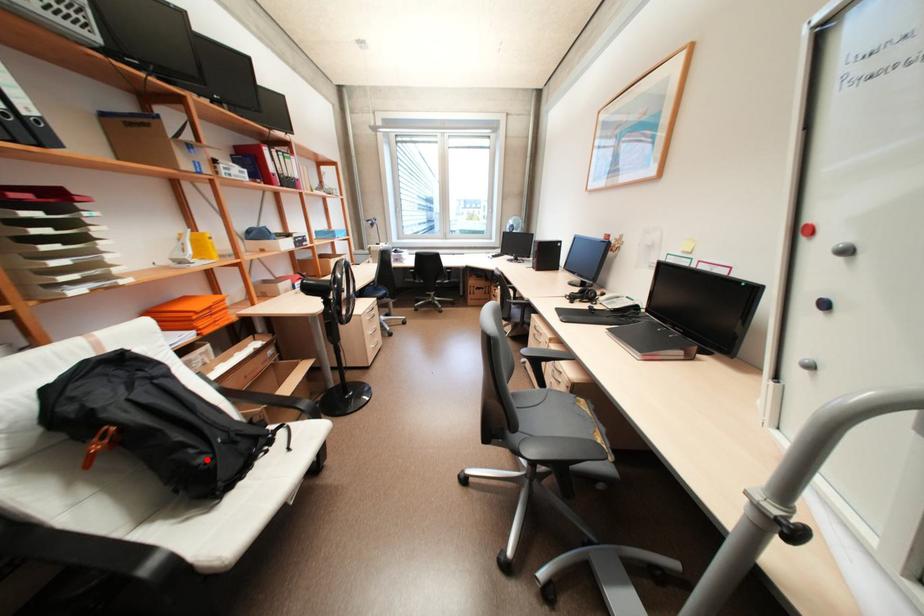
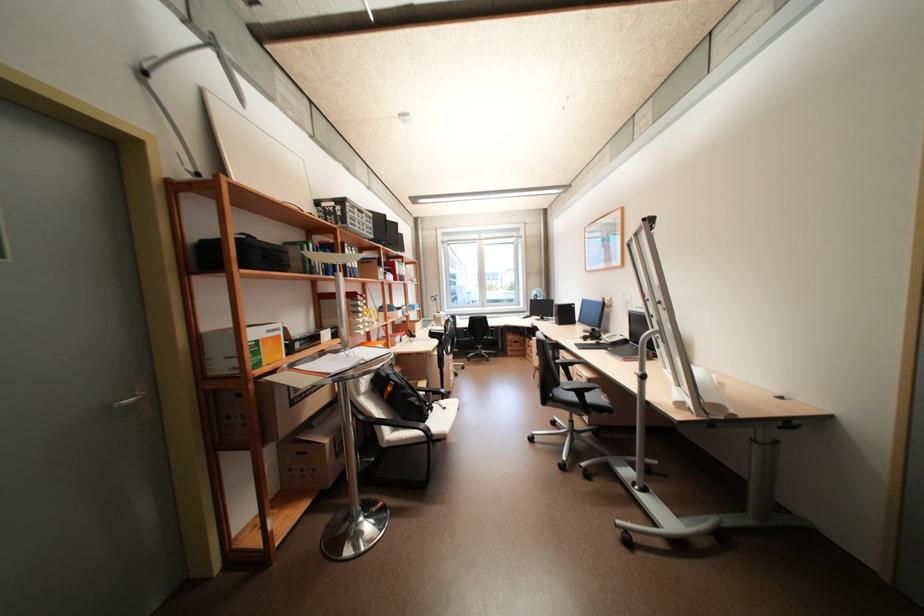
Find the pixel in the second image that matches the highlighted location in the first image.

(423, 403)